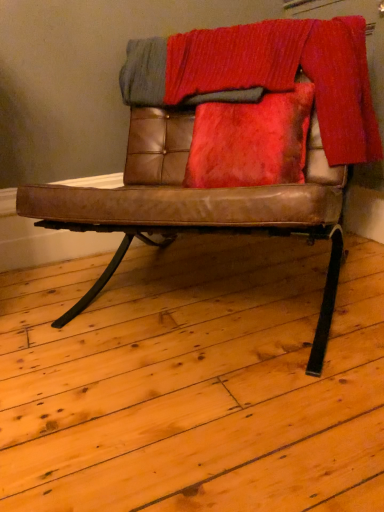
Question: Can you confirm if brown leather chair at center is bigger than knitted wool blanket at upper center?

Choices:
 (A) no
 (B) yes

Answer: (B)

Question: From a real-world perspective, is brown leather chair at center physically below knitted wool blanket at upper center?

Choices:
 (A) yes
 (B) no

Answer: (A)

Question: Is brown leather chair at center to the right of knitted wool blanket at upper center from the viewer's perspective?

Choices:
 (A) yes
 (B) no

Answer: (B)

Question: From a real-world perspective, does brown leather chair at center stand above knitted wool blanket at upper center?

Choices:
 (A) yes
 (B) no

Answer: (B)

Question: From the image's perspective, is brown leather chair at center beneath knitted wool blanket at upper center?

Choices:
 (A) no
 (B) yes

Answer: (B)

Question: From the image's perspective, would you say brown leather chair at center is positioned over knitted wool blanket at upper center?

Choices:
 (A) no
 (B) yes

Answer: (A)

Question: Is knitted wool blanket at upper center not within brown leather chair at center?

Choices:
 (A) yes
 (B) no

Answer: (B)

Question: Does knitted wool blanket at upper center have a larger size compared to brown leather chair at center?

Choices:
 (A) yes
 (B) no

Answer: (B)

Question: Can you confirm if knitted wool blanket at upper center is positioned to the left of brown leather chair at center?

Choices:
 (A) yes
 (B) no

Answer: (B)

Question: Is knitted wool blanket at upper center to the right of brown leather chair at center from the viewer's perspective?

Choices:
 (A) yes
 (B) no

Answer: (A)

Question: Does knitted wool blanket at upper center lie in front of brown leather chair at center?

Choices:
 (A) yes
 (B) no

Answer: (B)

Question: Would you consider knitted wool blanket at upper center to be distant from brown leather chair at center?

Choices:
 (A) no
 (B) yes

Answer: (A)

Question: Is knitted wool blanket at upper center to the left or to the right of brown leather chair at center in the image?

Choices:
 (A) right
 (B) left

Answer: (A)